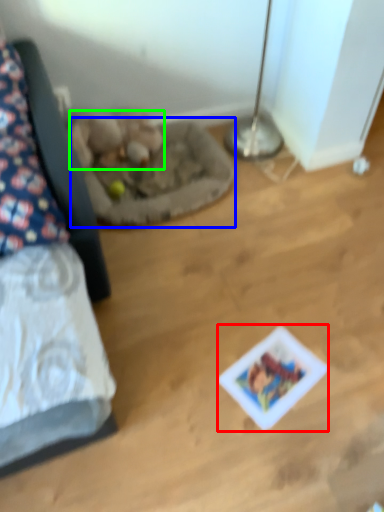
Question: Which object is the farthest from card game (highlighted by a red box)? Choose among these: cat bed (highlighted by a blue box) or animal (highlighted by a green box).

Choices:
 (A) cat bed
 (B) animal

Answer: (B)